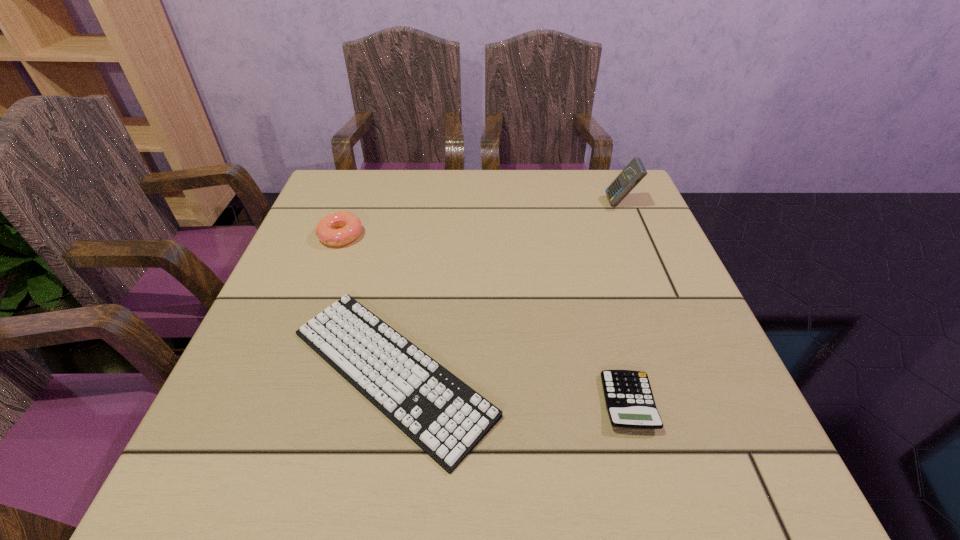
This screenshot has width=960, height=540. Find the location of `the rightmost object`. the rightmost object is located at coordinates (634, 172).

Locate an element on the screen. the taller calculator is located at coordinates (634, 172).

The width and height of the screenshot is (960, 540). I want to click on the second tallest object, so click(x=339, y=228).

The image size is (960, 540). Identify the location of the third nearest object. (339, 228).

Locate an element on the screen. This screenshot has width=960, height=540. the nearer calculator is located at coordinates (629, 400).

At what (x,y) coordinates should I click in order to perform the action: click on the shorter calculator. Please return your answer as a coordinate pair (x, y). Image resolution: width=960 pixels, height=540 pixels. Looking at the image, I should click on (629, 400).

Locate an element on the screen. The height and width of the screenshot is (540, 960). computer keyboard is located at coordinates (446, 418).

In order to click on vacant area located 0.090m on the front-facing side of the rightmost object in this screenshot , I will do coord(572,203).

The image size is (960, 540). I want to click on vacant area situated on the front-facing side of the rightmost object, so click(x=588, y=203).

Where is `free region located 0.350m on the front-facing side of the rightmost object`? This screenshot has width=960, height=540. free region located 0.350m on the front-facing side of the rightmost object is located at coordinates (474, 203).